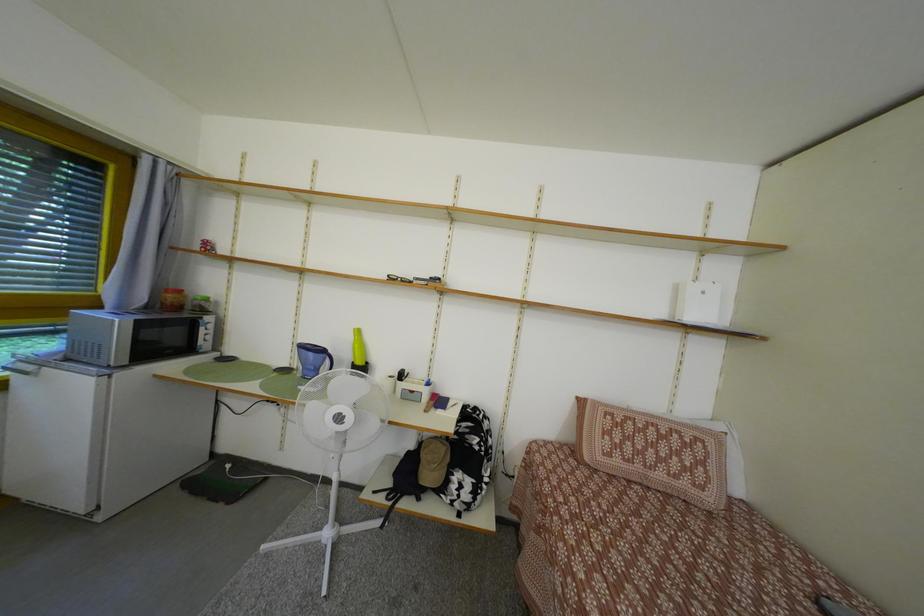
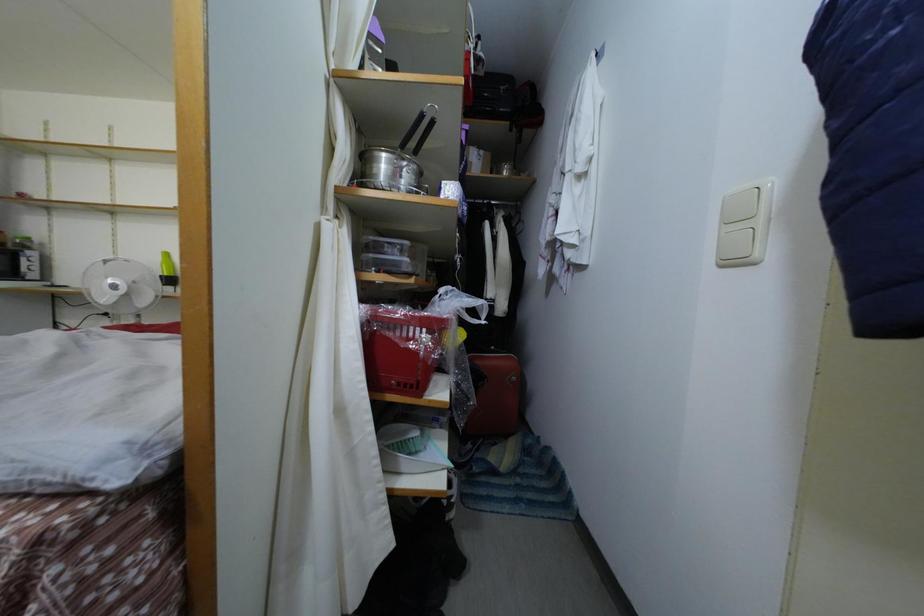
What movement of the cameraman would produce the second image?

The cameraman moved toward right, backward.